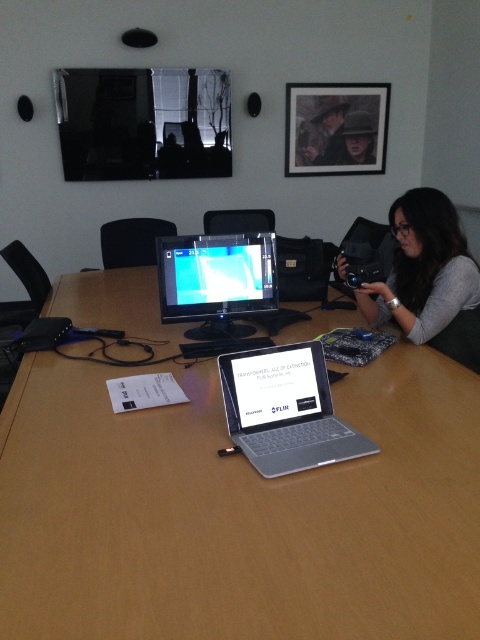
In the scene shown: Can you confirm if matte black camera at right is positioned to the left of silver metallic laptop at center?

In fact, matte black camera at right is to the right of silver metallic laptop at center.

Can you confirm if matte black camera at right is thinner than silver metallic laptop at center?

Incorrect, matte black camera at right's width is not less than silver metallic laptop at center's.

I want to click on matte black camera at right, so click(429, 278).

Does matte black camera at right appear over leather jacket at upper center?

Incorrect, matte black camera at right is not positioned above leather jacket at upper center.

Can you confirm if matte black camera at right is bigger than leather jacket at upper center?

Indeed, matte black camera at right has a larger size compared to leather jacket at upper center.

At what (x,y) coordinates should I click in order to perform the action: click on matte black camera at right. Please return your answer as a coordinate pair (x, y). The image size is (480, 640). Looking at the image, I should click on (429, 278).

I want to click on matte black camera at right, so click(x=429, y=278).

Who is taller, silver metallic laptop at center or matte black monitor at center?

Standing taller between the two is matte black monitor at center.

Which is more to the left, silver metallic laptop at center or matte black monitor at center?

From the viewer's perspective, matte black monitor at center appears more on the left side.

Does point (275, 429) come behind point (223, 323)?

No, it is in front of (223, 323).

Identify the location of silver metallic laptop at center. (286, 410).